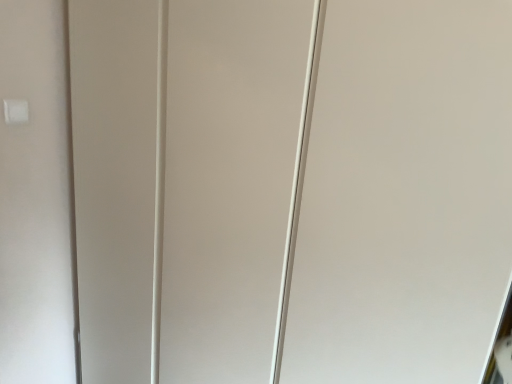
I want to click on white matte door at center, so click(x=404, y=195).

What is the approximate width of white matte door at center?

white matte door at center is 24.68 inches in width.

This screenshot has height=384, width=512. What do you see at coordinates (404, 195) in the screenshot?
I see `white matte door at center` at bounding box center [404, 195].

Find the location of `white matte door at center`. white matte door at center is located at coordinates (404, 195).